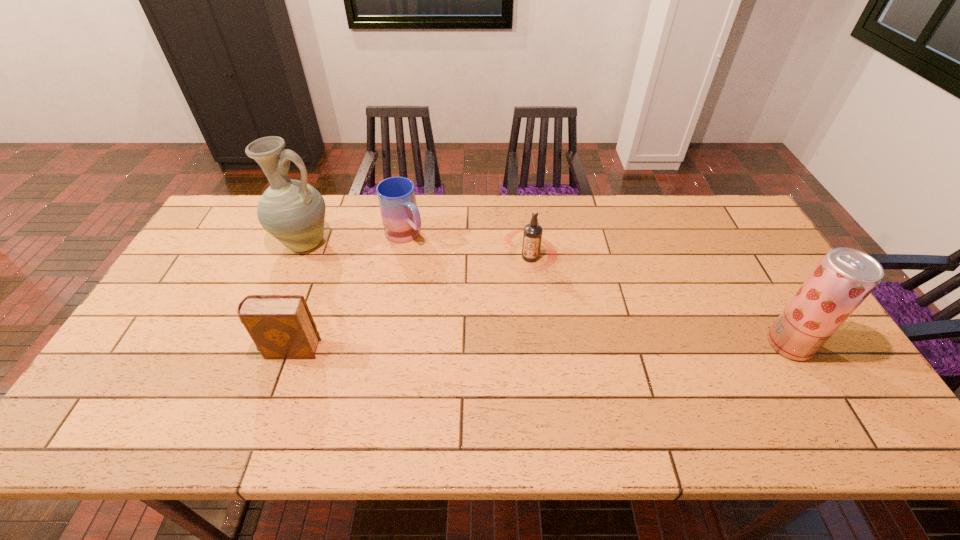
Find the location of a particular element. pitcher located at the far edge is located at coordinates (292, 211).

Find the location of a particular element. object that is at the right edge is located at coordinates (842, 280).

The height and width of the screenshot is (540, 960). Identify the location of vacant space at the far edge. (504, 237).

The width and height of the screenshot is (960, 540). Identify the location of free space at the near edge. (315, 399).

The image size is (960, 540). I want to click on vacant area at the left edge of the desktop, so click(x=181, y=287).

Identify the location of vacant space at the right edge. (736, 265).

Find the location of a particular element. Image resolution: width=960 pixels, height=540 pixels. vacant space at the far left corner of the desktop is located at coordinates (258, 229).

Image resolution: width=960 pixels, height=540 pixels. I want to click on vacant position at the far right corner of the desktop, so click(723, 239).

Find the location of a particular element. free space between the fourth object from left to right and the fruit juice is located at coordinates (660, 301).

Where is `free area in between the fruit juice and the diary`? This screenshot has width=960, height=540. free area in between the fruit juice and the diary is located at coordinates (540, 347).